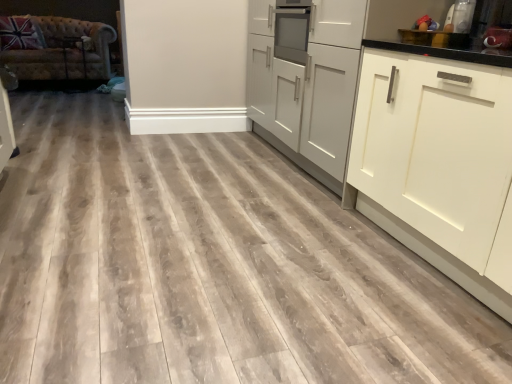
What is the approximate height of metallic silver toaster at upper right, the second appliance in the right-to-left sequence?

It is 10.62 inches.

Image resolution: width=512 pixels, height=384 pixels. What are the coordinates of `matte gray cabinets at center, the 2th cabinetry from the right` in the screenshot? It's located at (421, 144).

Image resolution: width=512 pixels, height=384 pixels. What do you see at coordinates (498, 37) in the screenshot? I see `metallic silver toaster at upper right, which appears as the first appliance when viewed from the right` at bounding box center [498, 37].

Find the location of `metallic silver toaster at upper right, the second appliance in the right-to-left sequence`. metallic silver toaster at upper right, the second appliance in the right-to-left sequence is located at coordinates (460, 16).

Is white matte cabinet at right, positioned as the 1th cabinetry in right-to-left order, surrounded by metallic silver toaster at upper right, which is counted as the 1th appliance, starting from the left?

No, metallic silver toaster at upper right, which is counted as the 1th appliance, starting from the left, does not contain white matte cabinet at right, positioned as the 1th cabinetry in right-to-left order.

In the scene shown: From the image's perspective, between metallic silver toaster at upper right, which is counted as the 1th appliance, starting from the left, and white matte cabinet at right, arranged as the 2th cabinetry when viewed from the left, which one is located above?

From the image's view, metallic silver toaster at upper right, which is counted as the 1th appliance, starting from the left, is above.

Is metallic silver toaster at upper right, the second appliance in the right-to-left sequence, beside white matte cabinet at right, arranged as the 2th cabinetry when viewed from the left?

No, metallic silver toaster at upper right, the second appliance in the right-to-left sequence, is not next to white matte cabinet at right, arranged as the 2th cabinetry when viewed from the left.

Measure the distance from metallic silver toaster at upper right, the second appliance in the right-to-left sequence, to white matte cabinet at right, positioned as the 1th cabinetry in right-to-left order.

metallic silver toaster at upper right, the second appliance in the right-to-left sequence, and white matte cabinet at right, positioned as the 1th cabinetry in right-to-left order, are 69.77 centimeters apart.

Is white matte cabinet at right, positioned as the 1th cabinetry in right-to-left order, smaller than matte gray cabinets at center, the first cabinetry in the left-to-right sequence?

Indeed, white matte cabinet at right, positioned as the 1th cabinetry in right-to-left order, has a smaller size compared to matte gray cabinets at center, the first cabinetry in the left-to-right sequence.

From the image's perspective, which is above, white matte cabinet at right, positioned as the 1th cabinetry in right-to-left order, or matte gray cabinets at center, the first cabinetry in the left-to-right sequence?

From the image's view, white matte cabinet at right, positioned as the 1th cabinetry in right-to-left order, is above.

Between white matte cabinet at right, positioned as the 1th cabinetry in right-to-left order, and matte gray cabinets at center, the 2th cabinetry from the right, which one has less height?

matte gray cabinets at center, the 2th cabinetry from the right, is shorter.

Is white matte cabinet at right, arranged as the 2th cabinetry when viewed from the left, next to matte gray cabinets at center, the 2th cabinetry from the right?

Yes, white matte cabinet at right, arranged as the 2th cabinetry when viewed from the left, is in contact with matte gray cabinets at center, the 2th cabinetry from the right.

Is tufted leather couch at left next to matte gray cabinets at center, the 2th cabinetry from the right?

There is a gap between tufted leather couch at left and matte gray cabinets at center, the 2th cabinetry from the right.

From a real-world perspective, does tufted leather couch at left stand above matte gray cabinets at center, the first cabinetry in the left-to-right sequence?

Actually, tufted leather couch at left is physically below matte gray cabinets at center, the first cabinetry in the left-to-right sequence, in the real world.

Considering the relative positions of tufted leather couch at left and matte gray cabinets at center, the first cabinetry in the left-to-right sequence, in the image provided, is tufted leather couch at left to the right of matte gray cabinets at center, the first cabinetry in the left-to-right sequence, from the viewer's perspective?

No.

Is tufted leather couch at left situated inside matte gray cabinets at center, the first cabinetry in the left-to-right sequence, or outside?

tufted leather couch at left is not enclosed by matte gray cabinets at center, the first cabinetry in the left-to-right sequence.

At what (x,y) coordinates should I click in order to perform the action: click on cabinetry that is the 2nd object located below the tufted leather couch at left (from the image's perspective). Please return your answer as a coordinate pair (x, y). Looking at the image, I should click on (421, 144).

In the scene shown: Could you tell me if matte gray cabinets at center, the 2th cabinetry from the right, is facing tufted leather couch at left?

No, matte gray cabinets at center, the 2th cabinetry from the right, is not turned towards tufted leather couch at left.

From the image's perspective, is matte gray cabinets at center, the 2th cabinetry from the right, under tufted leather couch at left?

Yes, from the image's perspective, matte gray cabinets at center, the 2th cabinetry from the right, is below tufted leather couch at left.

Is point (446, 170) closer to viewer compared to point (82, 55)?

Yes, point (446, 170) is closer to viewer.

Is matte gray cabinets at center, the first cabinetry in the left-to-right sequence, oriented towards white matte cabinet at right, positioned as the 1th cabinetry in right-to-left order?

No, matte gray cabinets at center, the first cabinetry in the left-to-right sequence, does not turn towards white matte cabinet at right, positioned as the 1th cabinetry in right-to-left order.

Which is more to the right, matte gray cabinets at center, the 2th cabinetry from the right, or white matte cabinet at right, positioned as the 1th cabinetry in right-to-left order?

From the viewer's perspective, white matte cabinet at right, positioned as the 1th cabinetry in right-to-left order, appears more on the right side.

From a real-world perspective, is matte gray cabinets at center, the first cabinetry in the left-to-right sequence, physically above white matte cabinet at right, arranged as the 2th cabinetry when viewed from the left?

Yes, from a real-world perspective, matte gray cabinets at center, the first cabinetry in the left-to-right sequence, is on top of white matte cabinet at right, arranged as the 2th cabinetry when viewed from the left.

Identify the location of cabinetry located above the matte gray cabinets at center, the 2th cabinetry from the right (from the image's perspective). (438, 152).

From a real-world perspective, between tufted leather couch at left and metallic silver toaster at upper right, the second appliance in the right-to-left sequence, who is vertically higher?

metallic silver toaster at upper right, the second appliance in the right-to-left sequence, is physically above.

Which is less distant, (17, 72) or (462, 25)?

Point (17, 72) is positioned farther from the camera compared to point (462, 25).

Do you think tufted leather couch at left is within metallic silver toaster at upper right, the second appliance in the right-to-left sequence, or outside of it?

tufted leather couch at left cannot be found inside metallic silver toaster at upper right, the second appliance in the right-to-left sequence.

Which object is closer to the camera, tufted leather couch at left or metallic silver toaster at upper right, which is counted as the 1th appliance, starting from the left?

metallic silver toaster at upper right, which is counted as the 1th appliance, starting from the left, is in front.

From a real-world perspective, which cabinetry is the 1st one underneath the metallic silver toaster at upper right, the 2th appliance positioned from the left? Please provide its 2D coordinates.

[(421, 144)]

Is metallic silver toaster at upper right, which appears as the first appliance when viewed from the right, positioned far away from matte gray cabinets at center, the first cabinetry in the left-to-right sequence?

No.

Looking at this image, can you tell me how much metallic silver toaster at upper right, the 2th appliance positioned from the left, and matte gray cabinets at center, the first cabinetry in the left-to-right sequence, differ in facing direction?

1.95 degrees separate the facing orientations of metallic silver toaster at upper right, the 2th appliance positioned from the left, and matte gray cabinets at center, the first cabinetry in the left-to-right sequence.

From a real-world perspective, is metallic silver toaster at upper right, which appears as the first appliance when viewed from the right, beneath matte gray cabinets at center, the first cabinetry in the left-to-right sequence?

Incorrect, from a real-world perspective, metallic silver toaster at upper right, which appears as the first appliance when viewed from the right, is higher than matte gray cabinets at center, the first cabinetry in the left-to-right sequence.

This screenshot has height=384, width=512. In order to click on cabinetry that is the 2nd object directly below the metallic silver toaster at upper right, which is counted as the 1th appliance, starting from the left (from a real-world perspective) in this screenshot , I will do point(438,152).

Find the location of a particular element. cabinetry located above the matte gray cabinets at center, the 2th cabinetry from the right (from the image's perspective) is located at coordinates (438, 152).

Based on their spatial positions, is metallic silver toaster at upper right, the 2th appliance positioned from the left, or matte gray cabinets at center, the 2th cabinetry from the right, closer to metallic silver toaster at upper right, the second appliance in the right-to-left sequence?

metallic silver toaster at upper right, the 2th appliance positioned from the left.

From the picture: Considering their positions, is tufted leather couch at left positioned further to metallic silver toaster at upper right, the second appliance in the right-to-left sequence, than white matte cabinet at right, positioned as the 1th cabinetry in right-to-left order?

tufted leather couch at left lies further to metallic silver toaster at upper right, the second appliance in the right-to-left sequence, than the other object.

Which object lies further to the anchor point white matte cabinet at right, arranged as the 2th cabinetry when viewed from the left, metallic silver toaster at upper right, which appears as the first appliance when viewed from the right, or metallic silver toaster at upper right, which is counted as the 1th appliance, starting from the left?

metallic silver toaster at upper right, which is counted as the 1th appliance, starting from the left, is positioned further to the anchor white matte cabinet at right, arranged as the 2th cabinetry when viewed from the left.

Which object lies nearer to the anchor point white matte cabinet at right, positioned as the 1th cabinetry in right-to-left order, tufted leather couch at left or matte gray cabinets at center, the 2th cabinetry from the right?

Based on the image, matte gray cabinets at center, the 2th cabinetry from the right, appears to be nearer to white matte cabinet at right, positioned as the 1th cabinetry in right-to-left order.

Looking at the image, which one is located further to tufted leather couch at left, metallic silver toaster at upper right, the second appliance in the right-to-left sequence, or white matte cabinet at right, arranged as the 2th cabinetry when viewed from the left?

metallic silver toaster at upper right, the second appliance in the right-to-left sequence, lies further to tufted leather couch at left than the other object.

From the image, which object appears to be farther from metallic silver toaster at upper right, the 2th appliance positioned from the left, white matte cabinet at right, positioned as the 1th cabinetry in right-to-left order, or metallic silver toaster at upper right, which is counted as the 1th appliance, starting from the left?

white matte cabinet at right, positioned as the 1th cabinetry in right-to-left order, is positioned further to the anchor metallic silver toaster at upper right, the 2th appliance positioned from the left.

When comparing their distances from white matte cabinet at right, positioned as the 1th cabinetry in right-to-left order, does matte gray cabinets at center, the 2th cabinetry from the right, or tufted leather couch at left seem closer?

Based on the image, matte gray cabinets at center, the 2th cabinetry from the right, appears to be nearer to white matte cabinet at right, positioned as the 1th cabinetry in right-to-left order.

Based on their spatial positions, is white matte cabinet at right, positioned as the 1th cabinetry in right-to-left order, or tufted leather couch at left further from metallic silver toaster at upper right, the second appliance in the right-to-left sequence?

tufted leather couch at left is positioned further to the anchor metallic silver toaster at upper right, the second appliance in the right-to-left sequence.

In order to click on cabinetry positioned between matte gray cabinets at center, the first cabinetry in the left-to-right sequence, and metallic silver toaster at upper right, which is counted as the 1th appliance, starting from the left, from near to far in this screenshot , I will do `click(438, 152)`.

At what (x,y) coordinates should I click in order to perform the action: click on cabinetry between matte gray cabinets at center, the 2th cabinetry from the right, and metallic silver toaster at upper right, the 2th appliance positioned from the left, from front to back. Please return your answer as a coordinate pair (x, y). The height and width of the screenshot is (384, 512). Looking at the image, I should click on (438, 152).

In order to click on appliance situated between tufted leather couch at left and metallic silver toaster at upper right, which appears as the first appliance when viewed from the right, from left to right in this screenshot , I will do `click(460, 16)`.

This screenshot has width=512, height=384. Identify the location of appliance situated between tufted leather couch at left and white matte cabinet at right, positioned as the 1th cabinetry in right-to-left order, from left to right. (460, 16).